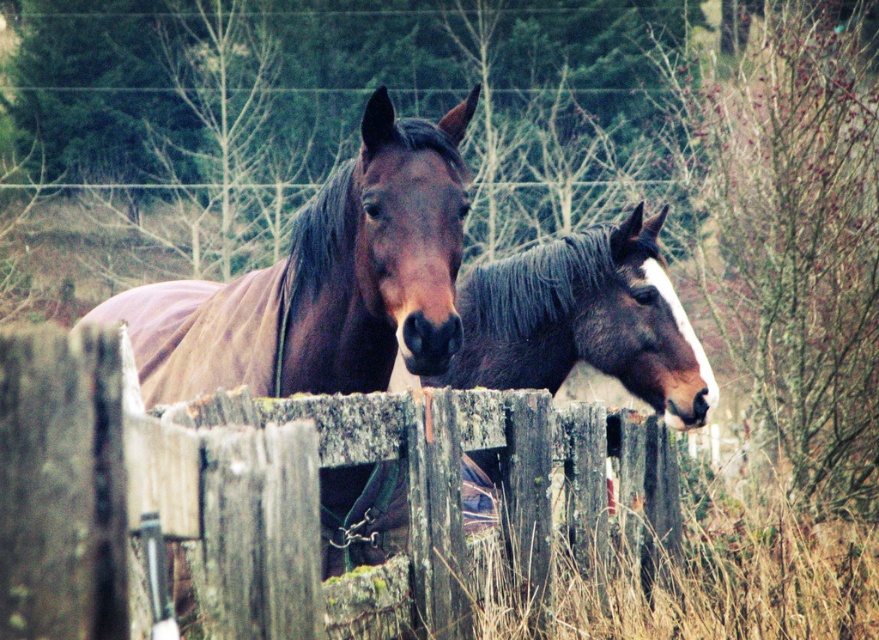
You are a farmer checking the height of your fence to ensure it can contain the horses. Based on the scene, which object is shorter, the weathered wood fence at center or the shiny brown horse at center?

The weathered wood fence at center is not as tall as the shiny brown horse at center, so the fence is shorter than the horse.

You are a photographer trying to capture both the weathered wood fence at center and the brown glossy horse at center in a single shot. Which object should you position closer to the left side of your camera frame to ensure both are fully visible?

The brown glossy horse at center should be positioned closer to the left side of your camera frame because the weathered wood fence at center is on its right side, so moving the horse leftward would allow the fence to remain in frame without overlapping.

From the picture: You are a photographer standing in front of the weathered wood fence at center and the shiny brown horse at center. You want to take a photo of the horse but need to ensure the fence isn not blocking it. Can you move closer to the horse without the fence blocking the view?

The weathered wood fence at center is further to the viewer than the shiny brown horse at center, so moving closer to the horse would bring it closer to the fence, potentially causing the fence to block the view. Therefore, you should not move closer to the horse to avoid the fence blocking it.